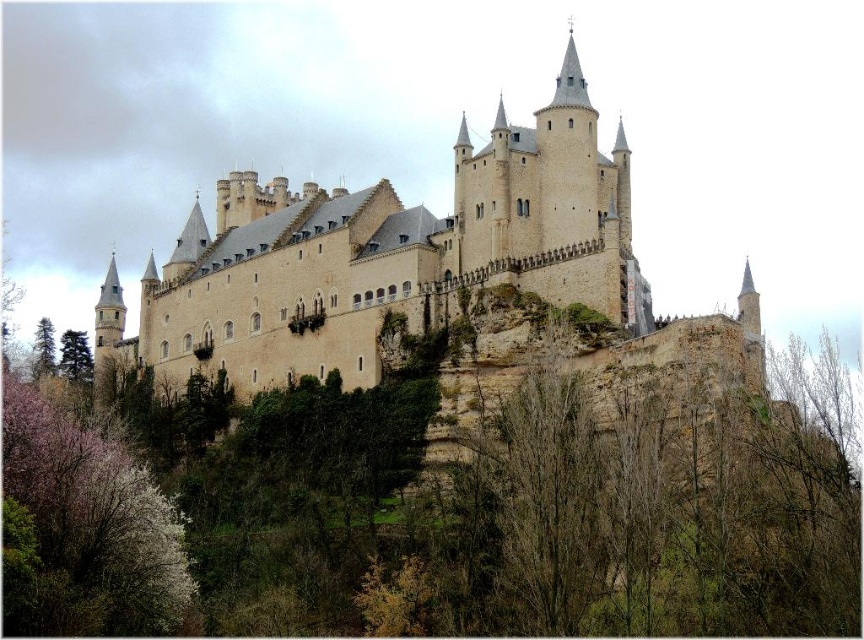
You are a gardener standing in front of the castle and notice two plants at the lower left corner of your view. One is pink blossoming branches at lower left and the other is green matte tree at lower left. Which one is closer to the ground?

The pink blossoming branches at lower left is located below the green matte tree at lower left, so it is closer to the ground.

You are standing at the base of the castle and want to take a photo of the point at coordinate point (17, 625). The camera you are using has a maximum focus range of 50 meters. Will the camera be able to focus on the point?

The distance of point (17, 625) from the camera is 50.91 meters, which exceeds the camera maximum focus range of 50 meters. Therefore, the camera will not be able to focus on the point.

Based on the photo, you are standing at the base of the castle and notice two points marked on the castle wall. The first point is at coordinates point (x=43, y=397) and the second is at point (x=51, y=336). Which point is closer to you?

Point (x=43, y=397) is in front of point (x=51, y=336), so it is closer to you.